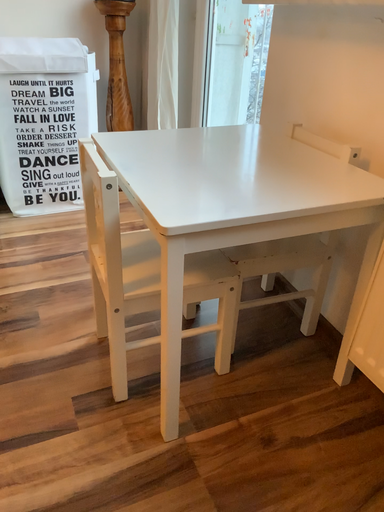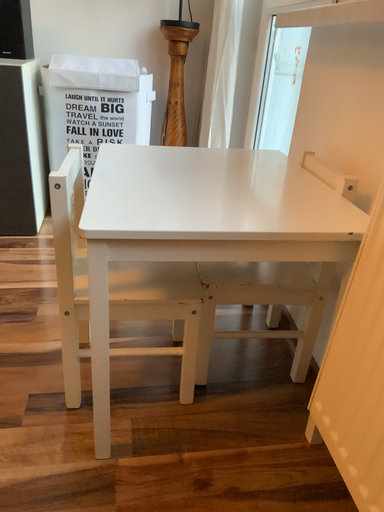
Question: How did the camera likely rotate when shooting the video?

Choices:
 (A) rotated right
 (B) rotated left

Answer: (B)